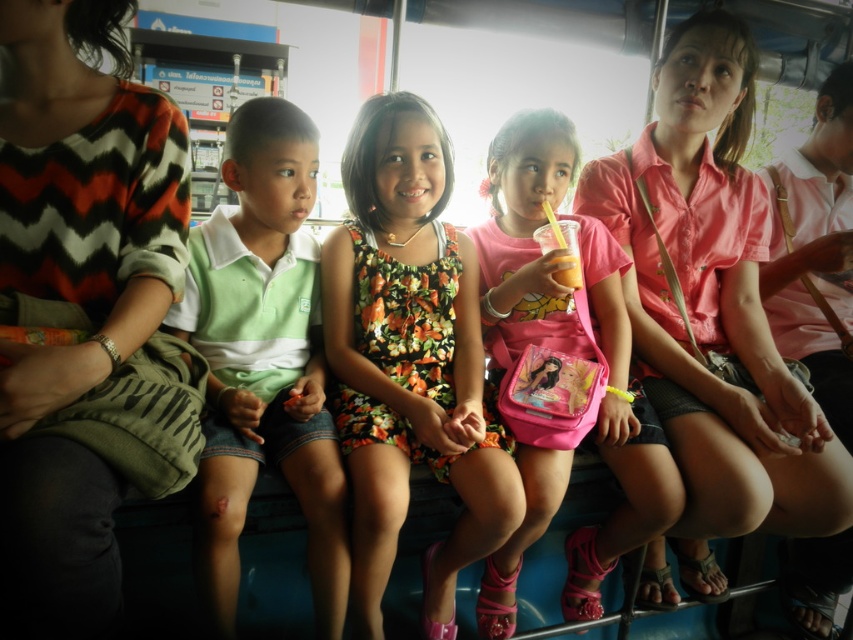
You are a photographer trying to capture a closeup of the floral dress at center and the pink fabric bag at center. Since you want to ensure both are in focus, you need to know which object is wider. Which one is wider?

The floral dress at center is wider than the pink fabric bag at center, so you should adjust your camera settings to focus on the wider object first.

You are a photographer standing at the front of the bus. You want to take a photo of the floral dress at center. Where should you aim your camera to capture it?

The floral dress at center is located at point 0.562 on the x axis and 0.481 on the y axis, so you should aim your camera towards those coordinates to capture it.